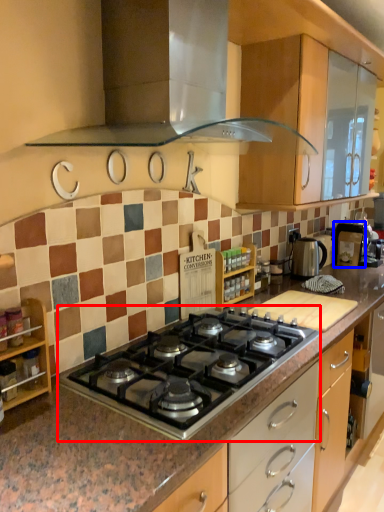
Question: Among these objects, which one is nearest to the camera, gas stove (highlighted by a red box) or appliance (highlighted by a blue box)?

Choices:
 (A) gas stove
 (B) appliance

Answer: (A)